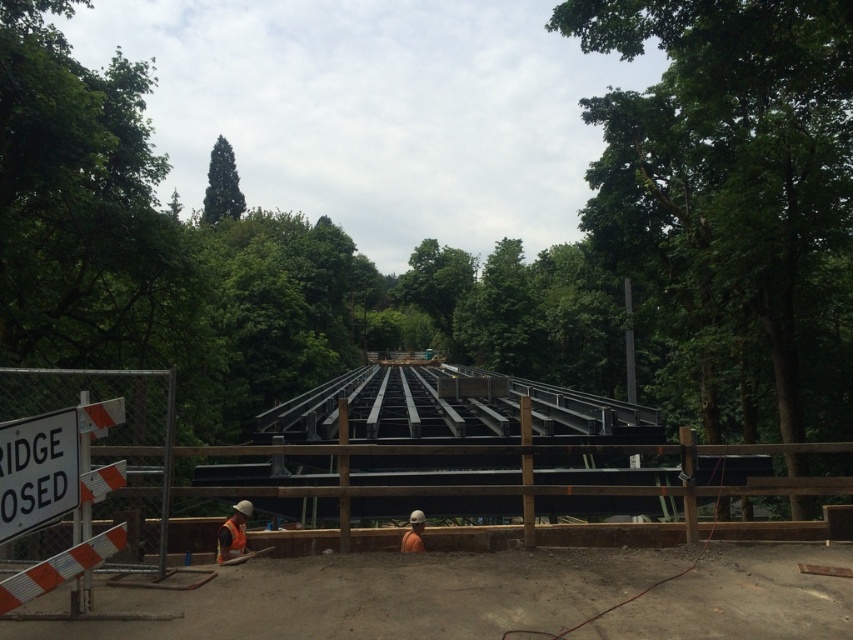
You are a safety inspector at the construction site. You notice the black steel beams at center and the orange safety vest at lower center. Which object is located closer to the bottom of the image?

The orange safety vest at lower center is closer to the bottom of the image because the black steel beams at center is positioned under it.

You are a delivery truck driver who needs to pass through the bridge. The truck is 8 meters wide. Based on the scene, can the truck safely pass through the gap between the black steel beams at center and the orange safety vest at lower center? Please explain your reasoning.

The gap between the black steel beams at center and the orange safety vest at lower center is 7.95 meters. Since the truck is 8 meters wide, it is slightly wider than the available space. Therefore, the truck cannot safely pass through the gap as there is insufficient width to accommodate its size.

You are a safety inspector standing at the construction site. You notice the black steel beams at center and the orange fabric safety vest at lower center. Which object is taller in the scene?

The black steel beams at center are taller than the orange fabric safety vest at lower center.